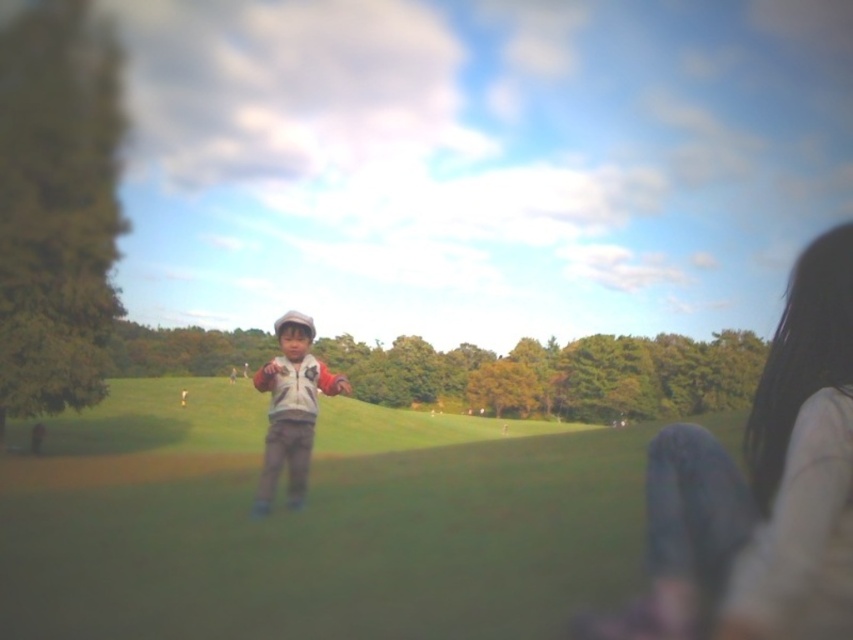
You are a photographer who wants to capture the child in the center of the image. The camera you are using has a zoom lens that can focus on objects at specific coordinates. The denim pants at lower right are at coordinates 0.748, 0.885. If you want to focus on the child in the center, which coordinates should you adjust the focus to?

To focus on the child in the center, you should adjust the focus to coordinates (426, 320) since the center of the image is typically at those coordinates, unlike the denim pants at lower right which are at (753, 477).

You are standing at the point closest to the camera in the image. Which point, point (x=643, y=621) or point (x=306, y=461), is closer to you?

Point (x=643, y=621) is in front of point (x=306, y=461), so it is closer to you.

You are a photographer trying to capture the child in the scene. You notice the denim pants at lower right and the matte gray jacket at center. Which object is covering the other in the image?

The denim pants at lower right is positioned over matte gray jacket at center, so it is covering the matte gray jacket at center.